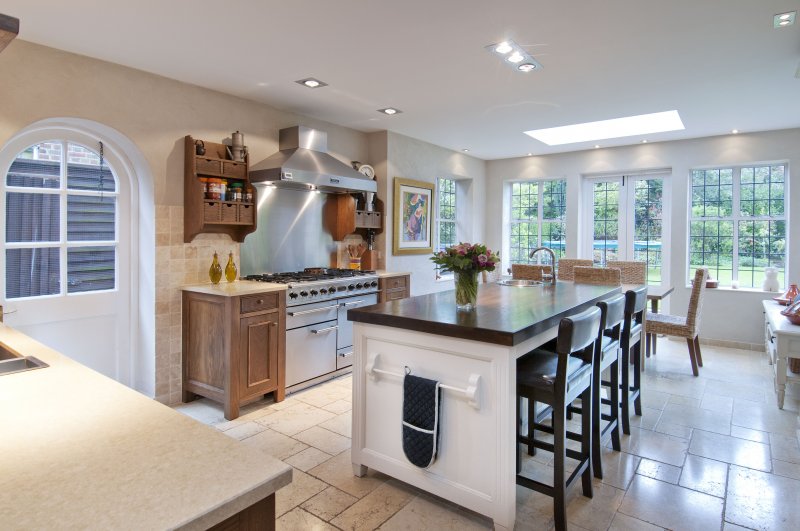
This screenshot has width=800, height=531. I want to click on hood, so click(x=320, y=179).